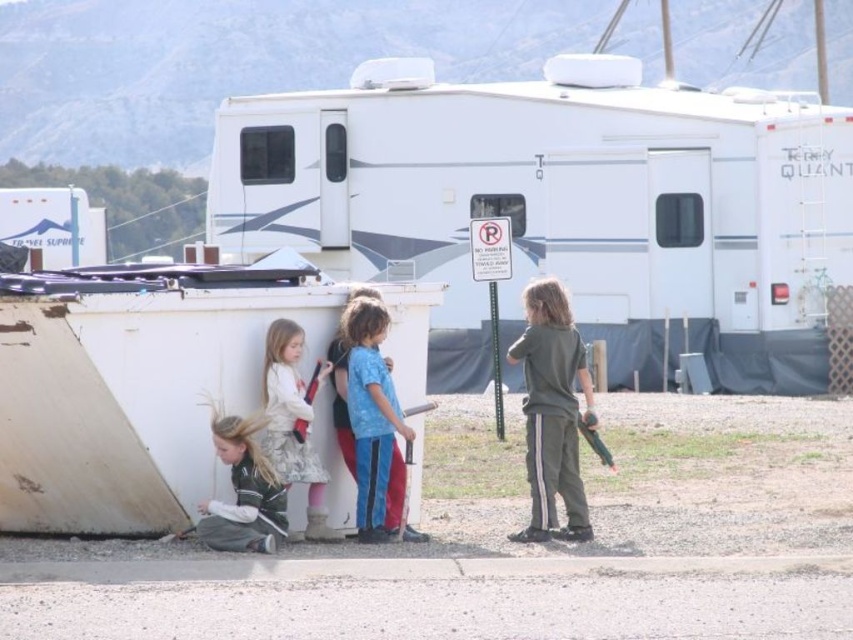
Question: Which object is positioned closest to the green matte pants at right?

Choices:
 (A) blue cotton shirt at center
 (B) white plastic recreational vehicle at upper center
 (C) green fabric jacket at lower left
 (D) fluffy white coat at center

Answer: (A)

Question: Is green matte pants at right positioned behind blue cotton shirt at center?

Choices:
 (A) yes
 (B) no

Answer: (B)

Question: Where is green matte pants at right located in relation to green fabric jacket at lower left in the image?

Choices:
 (A) below
 (B) above

Answer: (B)

Question: Does green matte pants at right appear over green fabric jacket at lower left?

Choices:
 (A) no
 (B) yes

Answer: (B)

Question: Which object appears closest to the camera in this image?

Choices:
 (A) blue cotton shirt at center
 (B) white plastic recreational vehicle at upper center

Answer: (A)

Question: Which of the following is the closest to the observer?

Choices:
 (A) green matte pants at right
 (B) blue cotton shirt at center

Answer: (A)